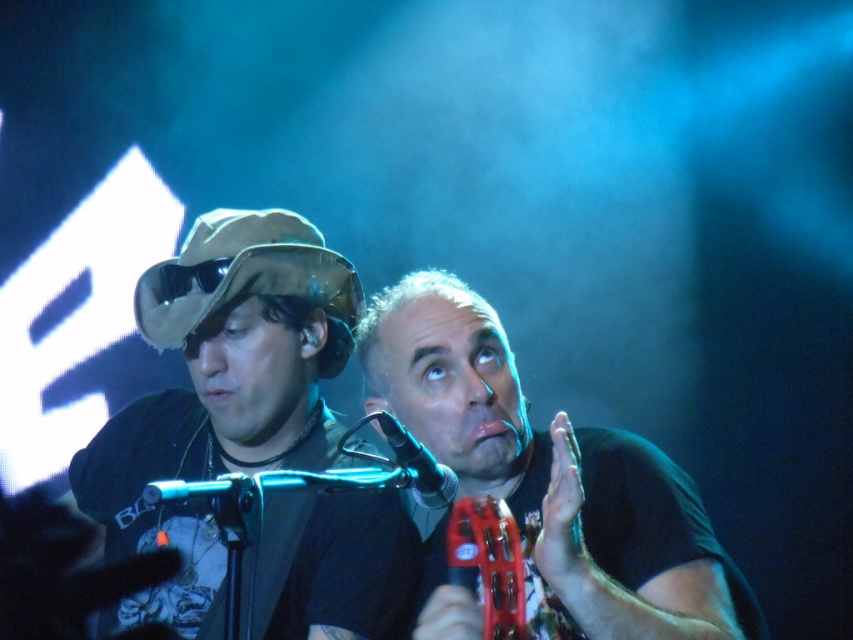
Question: Which object appears farthest from the camera in this image?

Choices:
 (A) matte brown hat at left
 (B) matte black tambourine at center

Answer: (A)

Question: Which point is farther to the camera?

Choices:
 (A) (646, 625)
 (B) (190, 621)

Answer: (B)

Question: Can you confirm if matte brown hat at left is positioned below matte black tambourine at center?

Choices:
 (A) no
 (B) yes

Answer: (A)

Question: Observing the image, what is the correct spatial positioning of matte brown hat at left in reference to matte black tambourine at center?

Choices:
 (A) left
 (B) right

Answer: (A)

Question: Which of the following is the closest to the observer?

Choices:
 (A) matte black tambourine at center
 (B) matte brown hat at left

Answer: (A)

Question: Does matte brown hat at left have a smaller size compared to matte black tambourine at center?

Choices:
 (A) no
 (B) yes

Answer: (A)